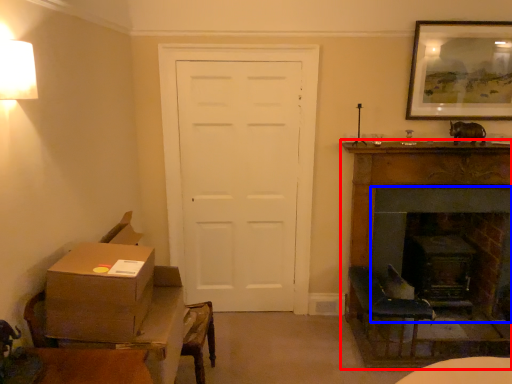
Question: Which object is further to the camera taking this photo, fireplace (highlighted by a red box) or fireplace (highlighted by a blue box)?

Choices:
 (A) fireplace
 (B) fireplace

Answer: (B)